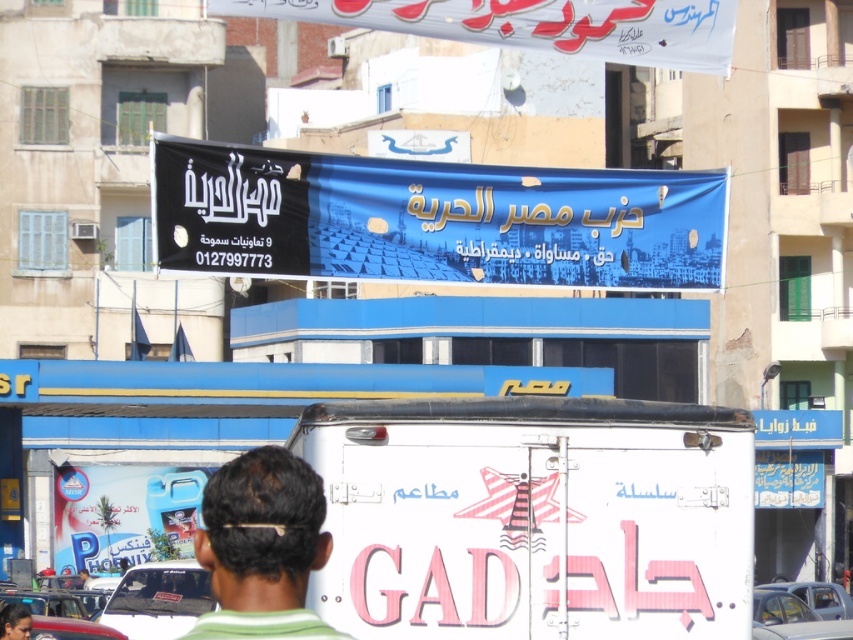
Between dark brown hair at center and dark brown hair at upper center, which one has less height?

With less height is dark brown hair at upper center.

Which is behind, point (228, 632) or point (4, 625)?

Point (4, 625)

Measure the distance between dark brown hair at center and camera.

The distance of dark brown hair at center from camera is 6.92 meters.

Locate an element on the screen. Image resolution: width=853 pixels, height=640 pixels. dark brown hair at center is located at coordinates (262, 547).

The image size is (853, 640). Find the location of `blue fabric banner at center`. blue fabric banner at center is located at coordinates (433, 220).

Can you confirm if blue fabric banner at center is thinner than dark brown hair at upper center?

No.

Between point (286, 257) and point (0, 636), which one is positioned in front?

Point (0, 636)

The width and height of the screenshot is (853, 640). In order to click on blue fabric banner at center in this screenshot , I will do `click(433, 220)`.

Is point (543, 275) closer to viewer compared to point (306, 472)?

No, it is not.

Is the position of blue fabric banner at center less distant than that of dark brown hair at center?

No, blue fabric banner at center is behind dark brown hair at center.

Describe the element at coordinates (433, 220) in the screenshot. The height and width of the screenshot is (640, 853). I see `blue fabric banner at center` at that location.

In order to click on blue fabric banner at center in this screenshot , I will do `click(433, 220)`.